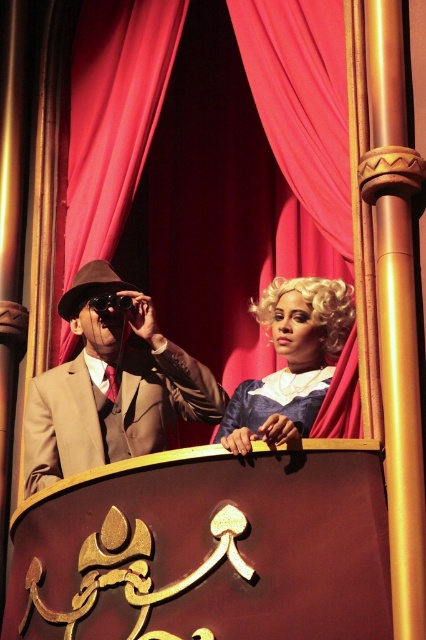
You are standing on the balcony and want to place a small potted plant between the two points marked as point [72,349] and point [301,348]. Will the plant be closer to the person on the left or the person on the right?

The plant will be closer to the person on the left because point [72,349] is closer to the camera than point [301,348], so the midpoint between them would be nearer to the front of the balcony where the person on the left is standing.

You are standing on the balcony and want to move from the matte brown suit at left to the edge of the balcony. Is the path clear?

The matte brown suit at left is located at point [111,387]. Since the scene description mentions the balcony has ornate gold detailing and red curtains but does not specify any obstacles between the suit and the edge, the path is likely clear. However, without explicit information about the exact layout between them, this is an assumption based on typical balcony designs.

You are standing on the balcony and want to look through the red velvet curtain at upper center to see what the person with the blonde wig at center is doing. Can you see their face clearly?

The red velvet curtain at upper center is located above the blonde wig at center, so it does not block the view of their face.